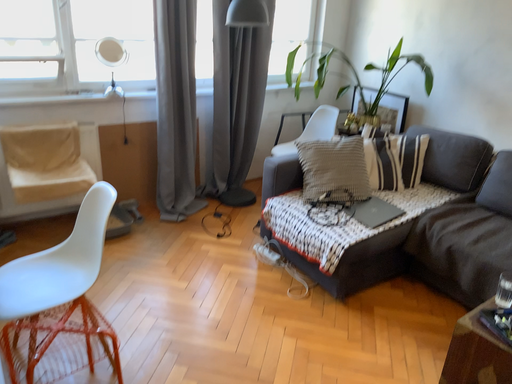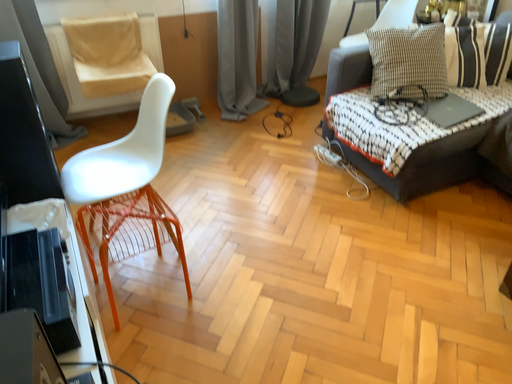
Question: Which way did the camera rotate in the video?

Choices:
 (A) rotated downward
 (B) rotated upward

Answer: (A)